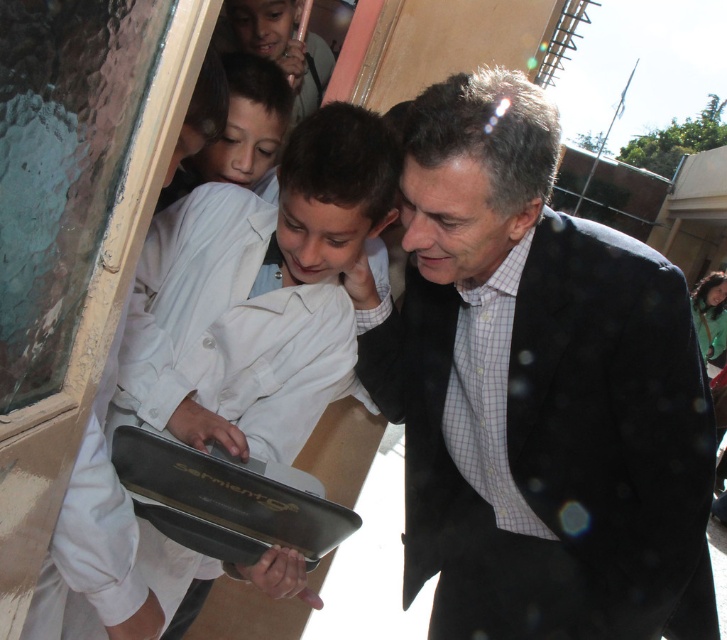
You are a photographer trying to capture a candid shot of the dark blue suit at center and the white matte laptop at center. Since you want both subjects to be in focus, you need to know their distance relationship. Which one is closer to you?

The dark blue suit at center is closer to the viewer than the white matte laptop at center, so you should focus on the dark blue suit at center to ensure both are in focus.

Based on the photo, you are a photographer trying to capture a candid shot of the scene. You want to ensure that both the dark blue suit at center and the white matte laptop at center are clearly visible in the frame. Based on their positions, which object should you focus on first to ensure both are in focus?

The dark blue suit at center is located below the white matte laptop at center. To ensure both are in focus, you should focus on the white matte laptop at center first since it is higher up and closer to the background, allowing the dark blue suit at center to fall within the depth of field.

You are standing at the camera position and want to reach the point at coordinates point [483,481]. If you can walk 6 feet in 1 minute, how long will it take you to reach that point?

The distance of point [483,481] from camera is 6.76 feet. At a walking speed of 6 feet per minute, it would take approximately 1.13 minutes to reach the point.